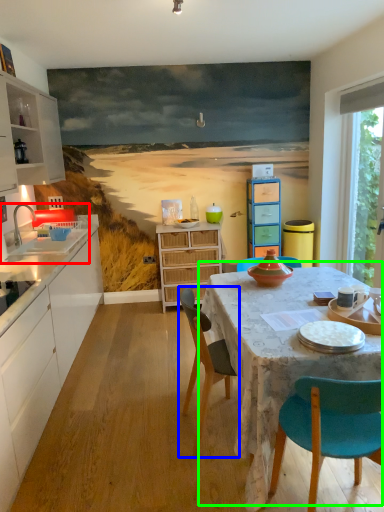
Question: Estimate the real-world distances between objects in this image. Which object is farther from sink (highlighted by a red box), chair (highlighted by a blue box) or kitchen & dining room table (highlighted by a green box)?

Choices:
 (A) chair
 (B) kitchen & dining room table

Answer: (B)